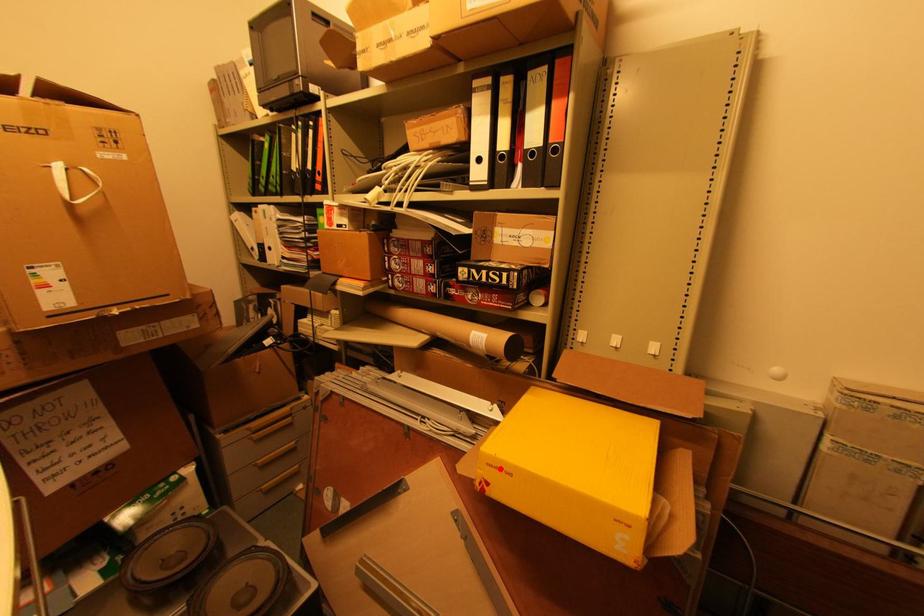
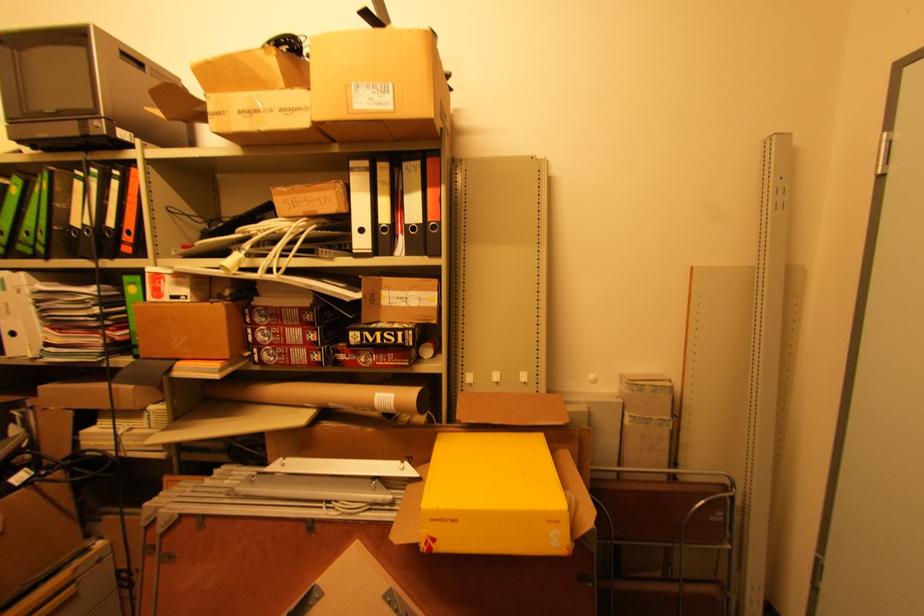
In the second image, find the point that corresponds to the highlighted location in the first image.

(444, 521)